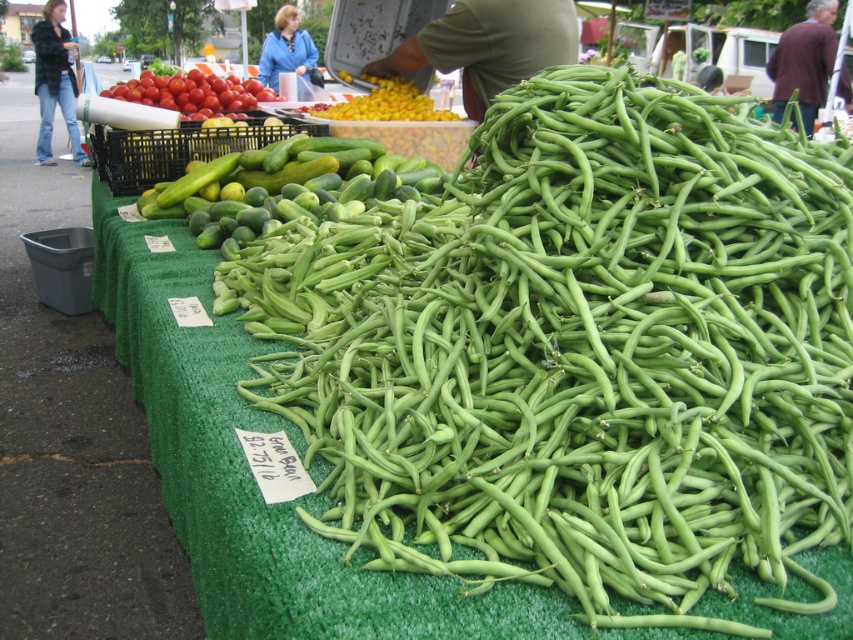
Question: Can you confirm if green smooth skin cucumber at center is positioned above yellow corn at center?

Choices:
 (A) yes
 (B) no

Answer: (B)

Question: Based on their relative distances, which object is farther from the green smooth beans at center?

Choices:
 (A) yellow corn at center
 (B) shiny red tomatoes at upper left
 (C) green smooth skin cucumber at center

Answer: (B)

Question: Does shiny red tomatoes at upper left appear on the left side of yellow corn at center?

Choices:
 (A) no
 (B) yes

Answer: (B)

Question: Does green smooth beans at center lie in front of green smooth skin cucumber at center?

Choices:
 (A) no
 (B) yes

Answer: (B)

Question: Which of the following is the farthest from the observer?

Choices:
 (A) yellow corn at center
 (B) green smooth skin cucumber at center
 (C) shiny red tomatoes at upper left

Answer: (C)

Question: Considering the real-world distances, which object is farthest from the green smooth beans at center?

Choices:
 (A) shiny red tomatoes at upper left
 (B) green smooth skin cucumber at center

Answer: (A)